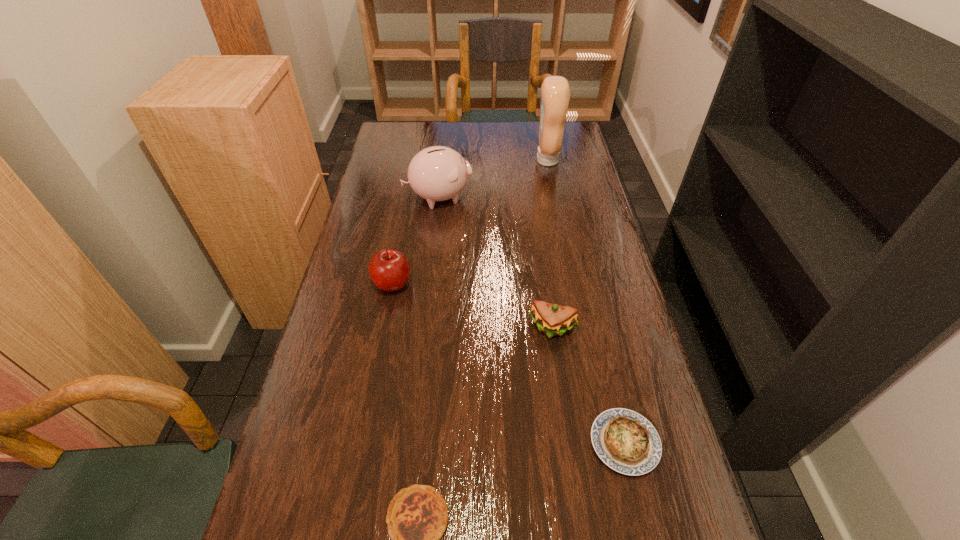
I want to click on condiment present at the right edge, so click(x=555, y=92).

The height and width of the screenshot is (540, 960). I want to click on sandwich situated at the right edge, so click(x=552, y=319).

This screenshot has width=960, height=540. I want to click on quiche situated at the right edge, so click(624, 440).

The image size is (960, 540). I want to click on object at the far right corner, so click(x=555, y=92).

Image resolution: width=960 pixels, height=540 pixels. Find the location of `vacant region at the far edge of the desktop`. vacant region at the far edge of the desktop is located at coordinates (516, 152).

In the image, there is a desktop. Where is `vacant space at the left edge`? This screenshot has height=540, width=960. vacant space at the left edge is located at coordinates (406, 204).

What are the coordinates of `free spot at the right edge of the desktop` in the screenshot? It's located at (580, 332).

At what (x,y) coordinates should I click in order to perform the action: click on vacant area that lies between the farthest object and the fifth nearest object. Please return your answer as a coordinate pair (x, y). Looking at the image, I should click on (492, 178).

You are a GUI agent. You are given a task and a screenshot of the screen. Output one action in this format:
    pyautogui.click(x=<x>, y=<y>)
    Task: Click on the vacant space that's between the tallest object and the apple
    This screenshot has width=960, height=540.
    Given the screenshot: What is the action you would take?
    tap(469, 222)

The height and width of the screenshot is (540, 960). Find the location of `vacant point located between the right quiche and the condiment`. vacant point located between the right quiche and the condiment is located at coordinates (586, 301).